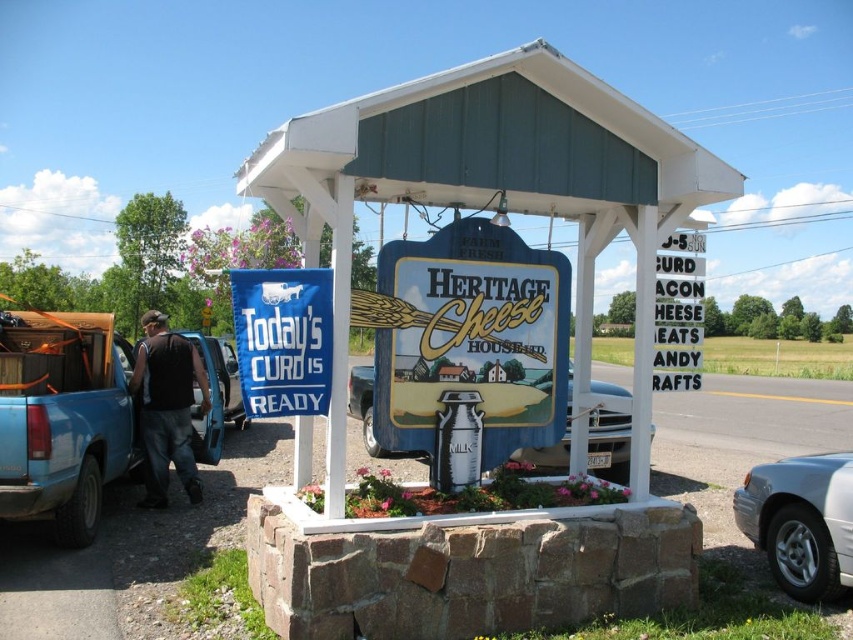
Does white wooden gazebo at center appear on the left side of metallic blue truck at center?

Yes, white wooden gazebo at center is to the left of metallic blue truck at center.

I want to click on white wooden gazebo at center, so click(x=495, y=188).

Image resolution: width=853 pixels, height=640 pixels. In order to click on white wooden gazebo at center in this screenshot , I will do `click(495, 188)`.

Identify the location of blue fabric banner at center. (283, 339).

Between point (270, 358) and point (851, 556), which one is positioned behind?

The point (851, 556) is behind.

Find the location of `blue fabric banner at center`. blue fabric banner at center is located at coordinates (283, 339).

Is black fabric backpack at left wider than black plastic sign at upper right?

Correct, the width of black fabric backpack at left exceeds that of black plastic sign at upper right.

Can you confirm if black fabric backpack at left is positioned to the right of black plastic sign at upper right?

In fact, black fabric backpack at left is to the left of black plastic sign at upper right.

Does point (163, 424) come farther from viewer compared to point (695, 355)?

That is True.

The height and width of the screenshot is (640, 853). Identify the location of black fabric backpack at left. (167, 406).